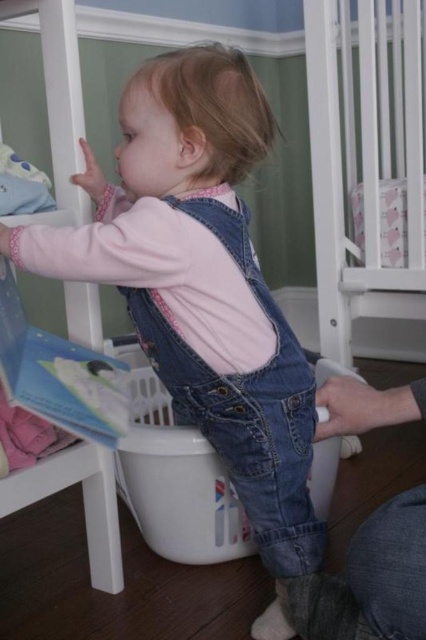
Question: Which point is farther to the camera?

Choices:
 (A) (210, 493)
 (B) (226, 195)

Answer: (A)

Question: Does denim overalls at center appear over white plastic laundry basket at center?

Choices:
 (A) yes
 (B) no

Answer: (A)

Question: Does denim overalls at center lie behind white plastic laundry basket at center?

Choices:
 (A) no
 (B) yes

Answer: (A)

Question: Is denim overalls at center positioned before white plastic laundry basket at center?

Choices:
 (A) yes
 (B) no

Answer: (A)